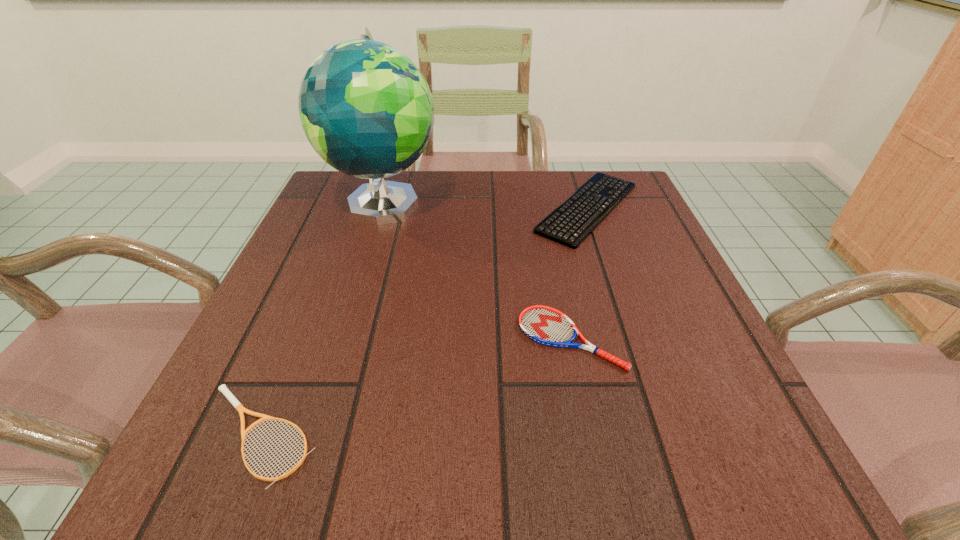
Image resolution: width=960 pixels, height=540 pixels. Identify the location of globe that is at the far edge. (366, 109).

Locate an element on the screen. computer keyboard present at the far edge is located at coordinates (565, 224).

Where is `object positioned at the near edge`? The height and width of the screenshot is (540, 960). object positioned at the near edge is located at coordinates (238, 406).

The image size is (960, 540). What are the coordinates of `globe that is at the left edge` in the screenshot? It's located at (366, 109).

Locate an element on the screen. The width and height of the screenshot is (960, 540). tennis racket that is at the left edge is located at coordinates (238, 406).

Where is `computer keyboard that is at the right edge`? This screenshot has height=540, width=960. computer keyboard that is at the right edge is located at coordinates (565, 224).

Locate an element on the screen. tennis racket present at the right edge is located at coordinates (545, 325).

You are a GUI agent. You are given a task and a screenshot of the screen. Output one action in this format:
    pyautogui.click(x=<x>, y=<y>)
    Task: Click on the object located at the far left corner
    
    Given the screenshot: What is the action you would take?
    pyautogui.click(x=366, y=109)

In order to click on object situated at the near left corner in this screenshot , I will do `click(238, 406)`.

Find the location of a particular element. This screenshot has height=540, width=960. object that is positioned at the far right corner is located at coordinates click(x=565, y=224).